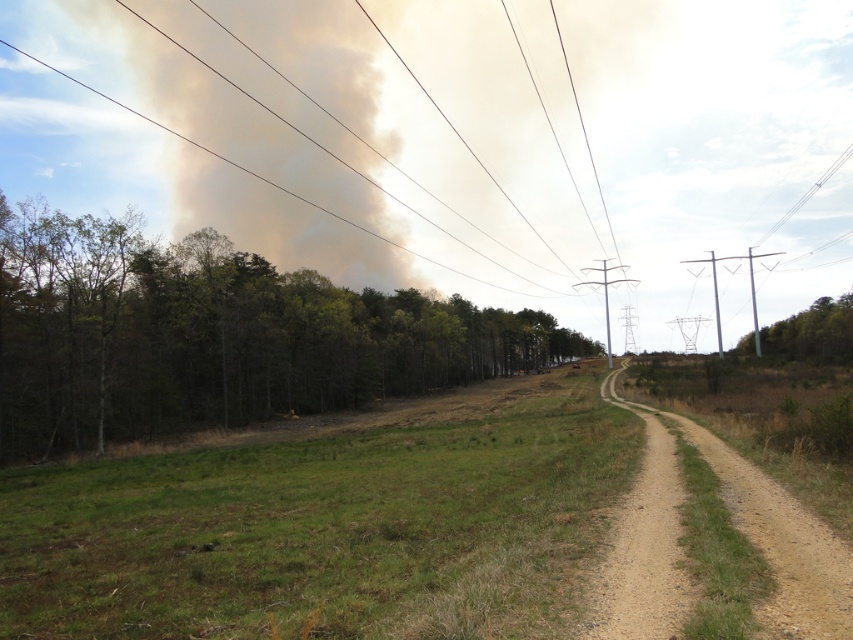
You are a hiker lost in the forest and see the green leafy trees at left. If you want to reach the dense forest, which direction should you walk?

The green leafy trees at left are located at point (213, 337), so you should walk to the left to reach the dense forest.

You are a hiker who wants to determine the direction of the forest relative to the road. Based on the image, which side of the road has the green leafy trees at left and which has the green leafy tree at right?

The green leafy trees at left are on the left side of the road, while the green leafy tree at right is on the right side of the road.